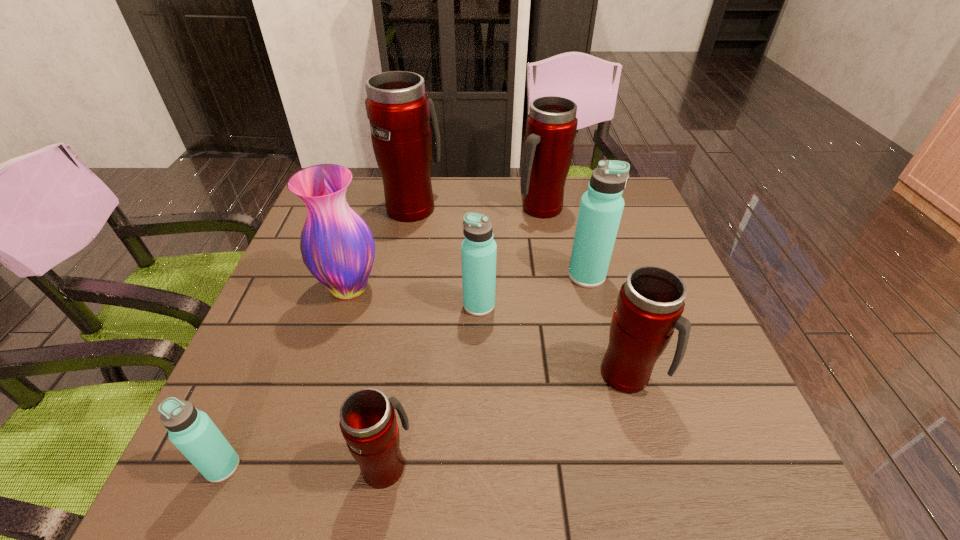
The width and height of the screenshot is (960, 540). I want to click on free space that satisfies the following two spatial constraints: 1. on the side with the handle of the second aqua thermos bottle from left to right; 2. on the left side of the smallest red thermos bottle, so click(x=411, y=305).

Locate an element on the screen. Image resolution: width=960 pixels, height=540 pixels. vacant space that satisfies the following two spatial constraints: 1. on the side with the handle of the fifth nearest thermos bottle; 2. on the left side of the third smallest red thermos bottle is located at coordinates click(x=552, y=275).

Where is `free region that satisfies the following two spatial constraints: 1. on the back side of the leftmost aqua thermos bottle; 2. on the right side of the second aqua thermos bottle from left to right`? The height and width of the screenshot is (540, 960). free region that satisfies the following two spatial constraints: 1. on the back side of the leftmost aqua thermos bottle; 2. on the right side of the second aqua thermos bottle from left to right is located at coordinates (292, 305).

Image resolution: width=960 pixels, height=540 pixels. In order to click on vacant space that satisfies the following two spatial constraints: 1. on the side with the handle of the rightmost aqua thermos bottle; 2. on the right side of the third smallest red thermos bottle in this screenshot , I will do `click(552, 275)`.

Locate an element on the screen. The image size is (960, 540). vacant area that satisfies the following two spatial constraints: 1. on the back side of the second biggest aqua thermos bottle; 2. on the left side of the biggest aqua thermos bottle is located at coordinates (479, 275).